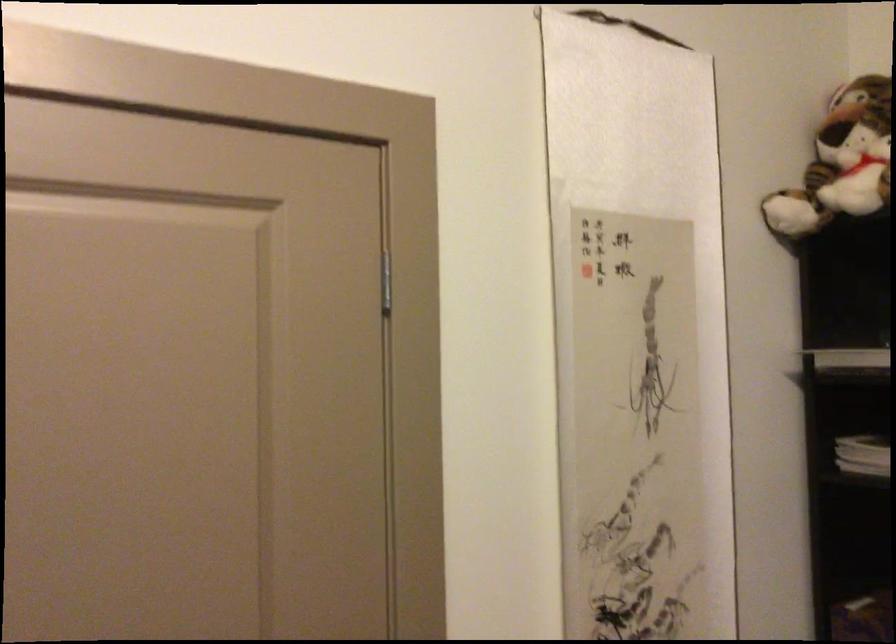
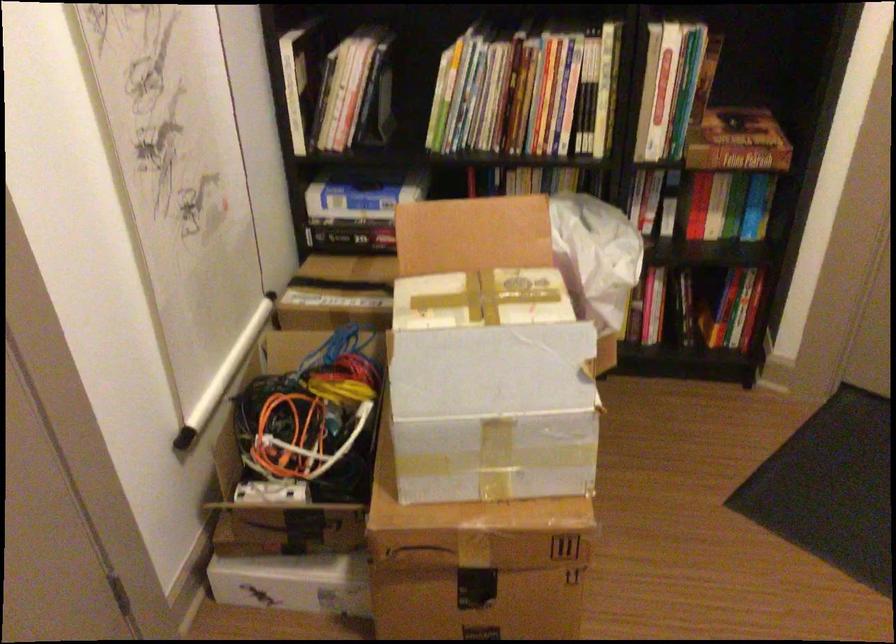
The first image is from the beginning of the video and the second image is from the end. How did the camera likely rotate when shooting the video?

The camera rotated toward right-down.